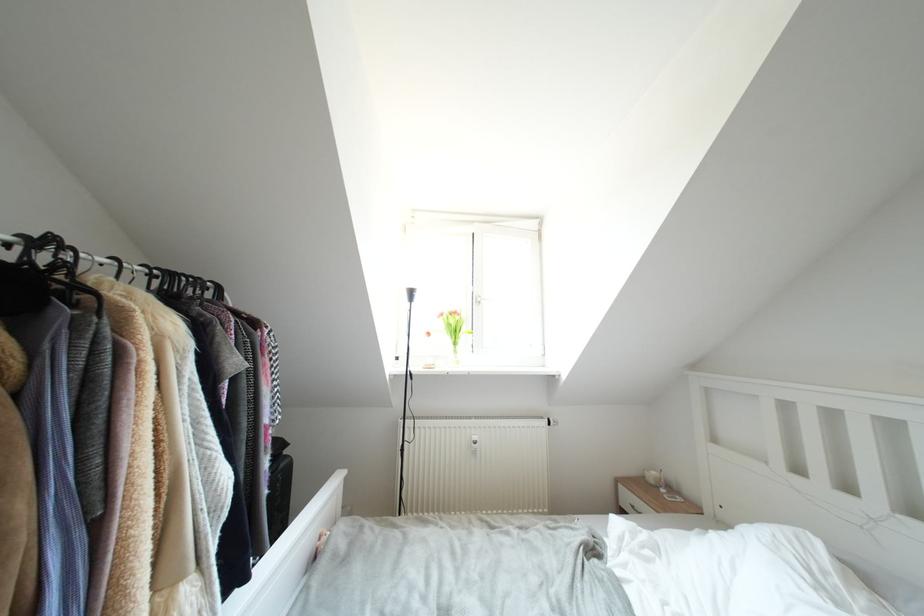
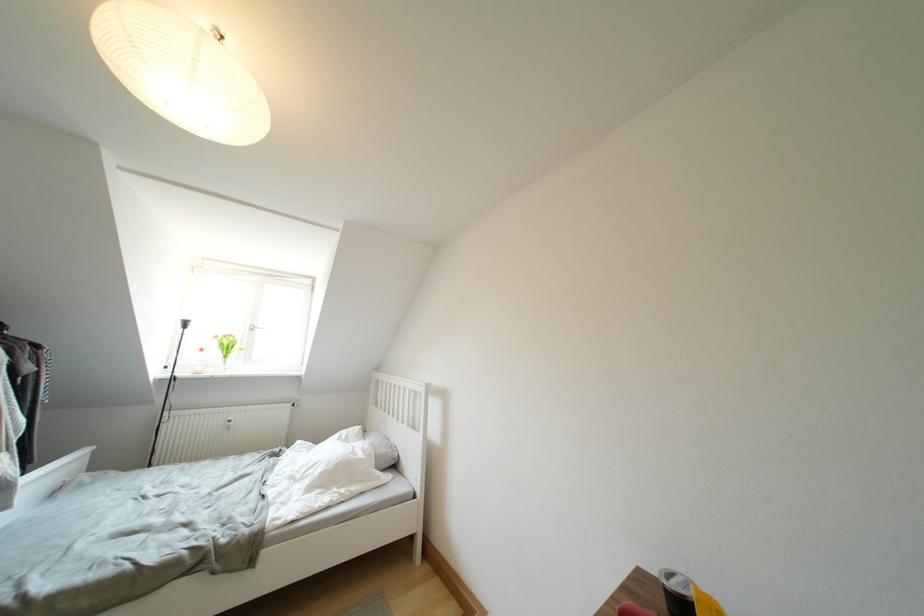
Question: I am providing you with two images of the same scene from different viewpoints. Which of the following objects are not visible in image2?

Choices:
 (A) glass vase
 (B) white pillow
 (C) black cup
 (D) none of these

Answer: (D)